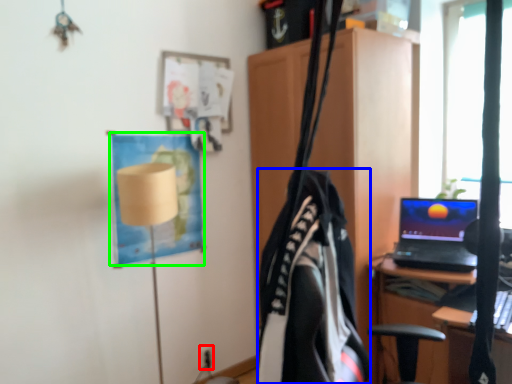
Question: Based on their relative distances, which object is farther from electric outlet (highlighted by a red box)? Choose from clothing (highlighted by a blue box) and poster (highlighted by a green box).

Choices:
 (A) clothing
 (B) poster

Answer: (A)